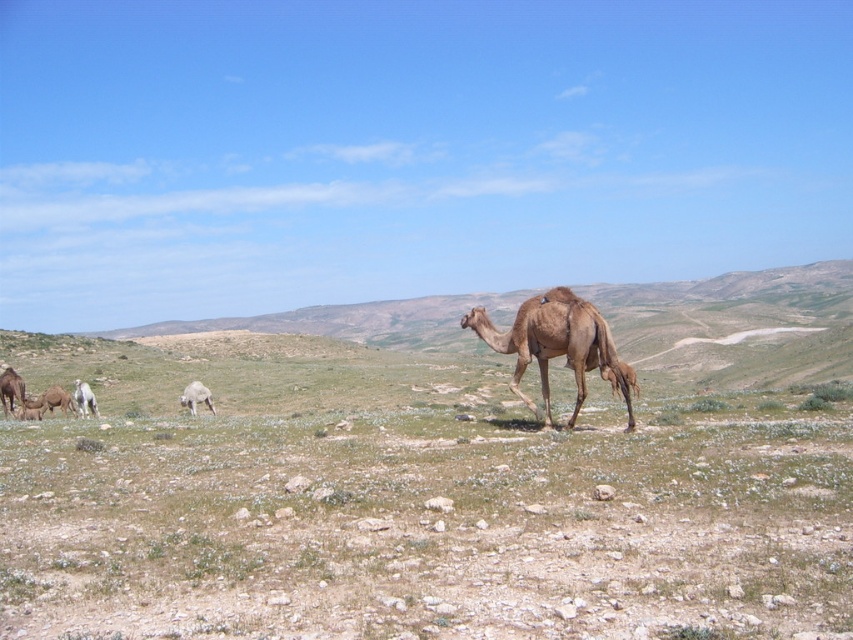
In the scene shown: You are a photographer trying to capture the white woolly sheep at lower left and the light brown camel at lower left in the same frame. Which animal will appear bigger in your photo?

The white woolly sheep at lower left will appear bigger in the photo because it has a larger size compared to the light brown camel at lower left.

You are a photographer standing in the desert scene. You want to take a photo that includes both the brown matte camel at center and the white woolly sheep at lower left. Given that your camera has a maximum focus range of 60 feet, will you be able to capture both subjects in focus without moving your position?

The brown matte camel at center and the white woolly sheep at lower left are 61.60 feet apart. Since the distance between them exceeds the camera maximum focus range of 60 feet, you cannot capture both subjects in focus without moving your position.

You are standing in the desert scene shown. There is a point at coordinates point (x=544, y=355). Can you walk to that point from your current position without moving more than 50 feet?

The point (x=544, y=355) is 52.87 feet away from the camera, so you cannot walk to it without moving more than 50 feet.